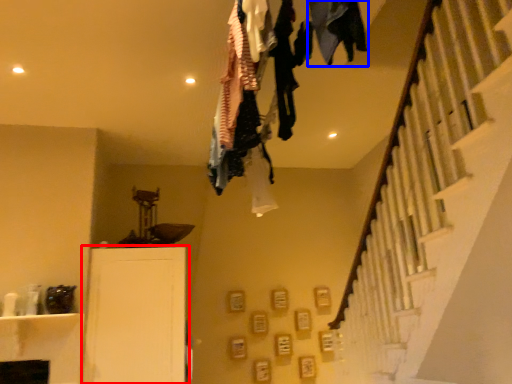
Question: Among these objects, which one is farthest to the camera, furniture (highlighted by a red box) or clothing (highlighted by a blue box)?

Choices:
 (A) furniture
 (B) clothing

Answer: (A)